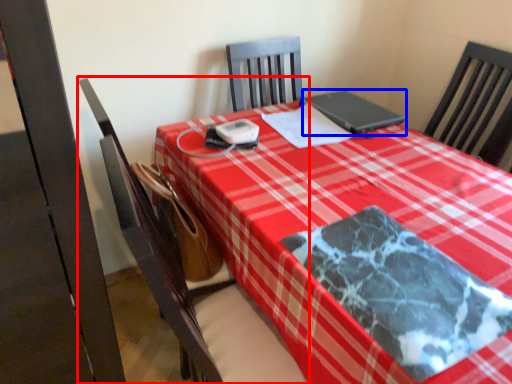
Question: Which point is further to the camera, chair (highlighted by a red box) or laptop (highlighted by a blue box)?

Choices:
 (A) chair
 (B) laptop

Answer: (B)